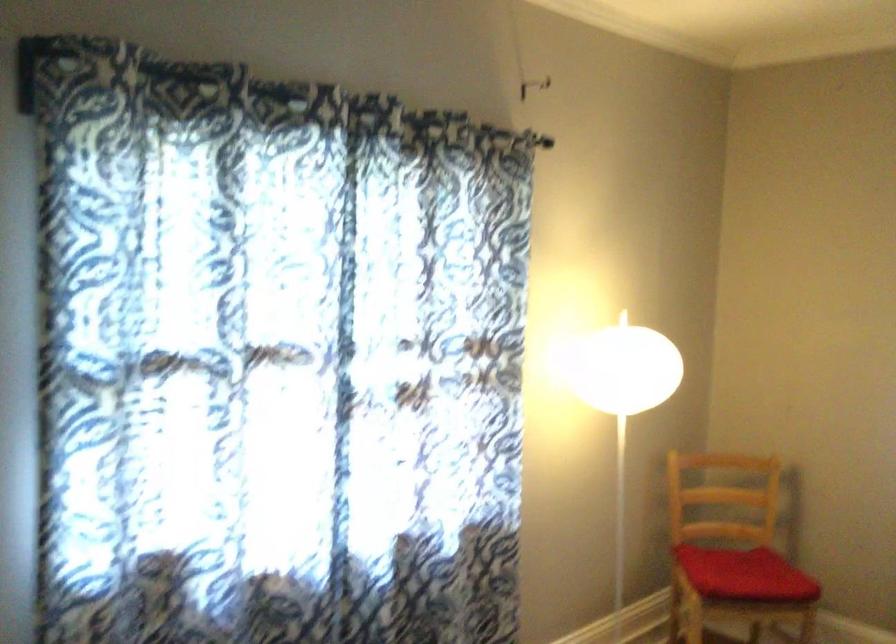
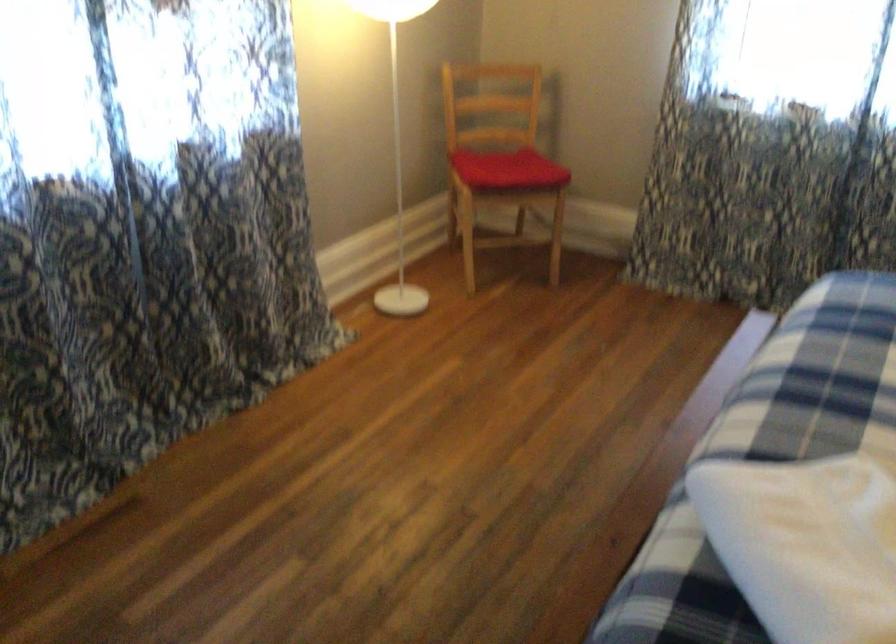
In the second image, find the point that corresponds to the point at 748,569 in the first image.

(507, 169)